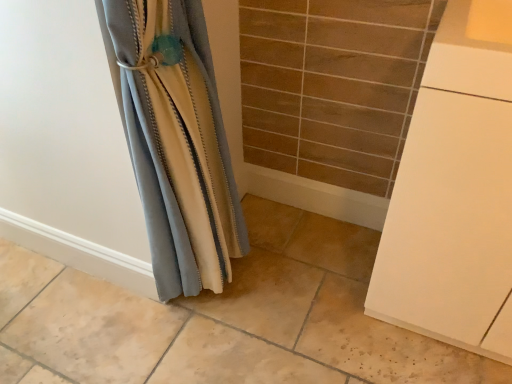
Question: Is white matte cabinet at right wider than satin fabric curtain at left?

Choices:
 (A) no
 (B) yes

Answer: (B)

Question: Considering the relative sizes of white matte cabinet at right and satin fabric curtain at left in the image provided, is white matte cabinet at right thinner than satin fabric curtain at left?

Choices:
 (A) no
 (B) yes

Answer: (A)

Question: From a real-world perspective, is white matte cabinet at right positioned under satin fabric curtain at left based on gravity?

Choices:
 (A) yes
 (B) no

Answer: (A)

Question: Is white matte cabinet at right facing away from satin fabric curtain at left?

Choices:
 (A) yes
 (B) no

Answer: (B)

Question: Would you say white matte cabinet at right is outside satin fabric curtain at left?

Choices:
 (A) yes
 (B) no

Answer: (A)

Question: From the image's perspective, is white matte cabinet at right beneath satin fabric curtain at left?

Choices:
 (A) yes
 (B) no

Answer: (A)

Question: Can you confirm if satin fabric curtain at left is bigger than white matte cabinet at right?

Choices:
 (A) yes
 (B) no

Answer: (B)

Question: Is satin fabric curtain at left far away from white matte cabinet at right?

Choices:
 (A) yes
 (B) no

Answer: (B)

Question: From the image's perspective, does satin fabric curtain at left appear lower than white matte cabinet at right?

Choices:
 (A) no
 (B) yes

Answer: (A)

Question: Would you say white matte cabinet at right is part of satin fabric curtain at left's contents?

Choices:
 (A) yes
 (B) no

Answer: (B)

Question: Can you confirm if satin fabric curtain at left is taller than white matte cabinet at right?

Choices:
 (A) yes
 (B) no

Answer: (A)

Question: Is satin fabric curtain at left facing away from white matte cabinet at right?

Choices:
 (A) yes
 (B) no

Answer: (B)

Question: From a real-world perspective, is white matte cabinet at right positioned above or below satin fabric curtain at left?

Choices:
 (A) below
 (B) above

Answer: (A)